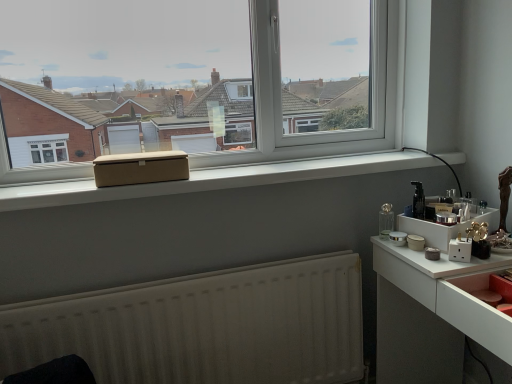
Identify the location of blank space situated above beige fabric box at center (from a real-world perspective). This screenshot has height=384, width=512. (138, 155).